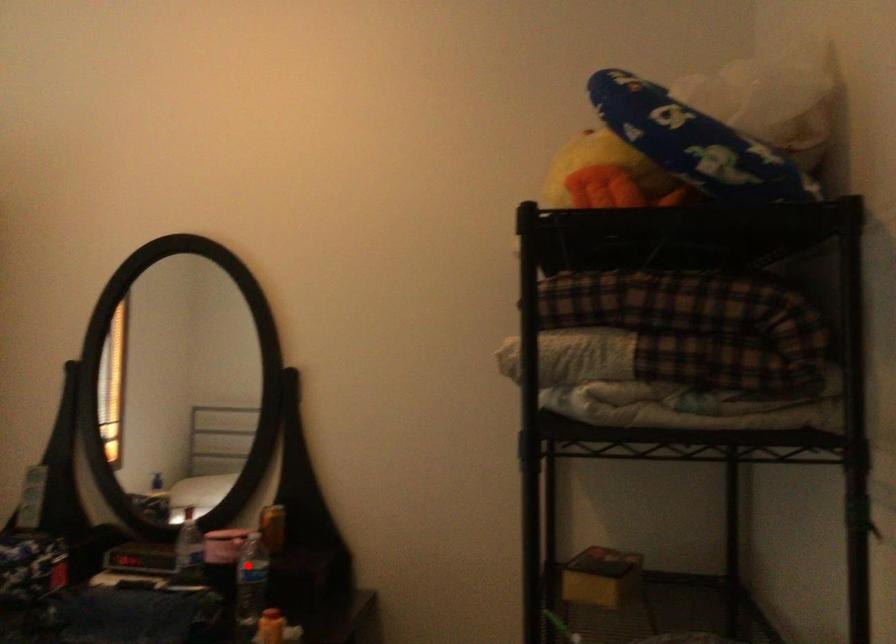
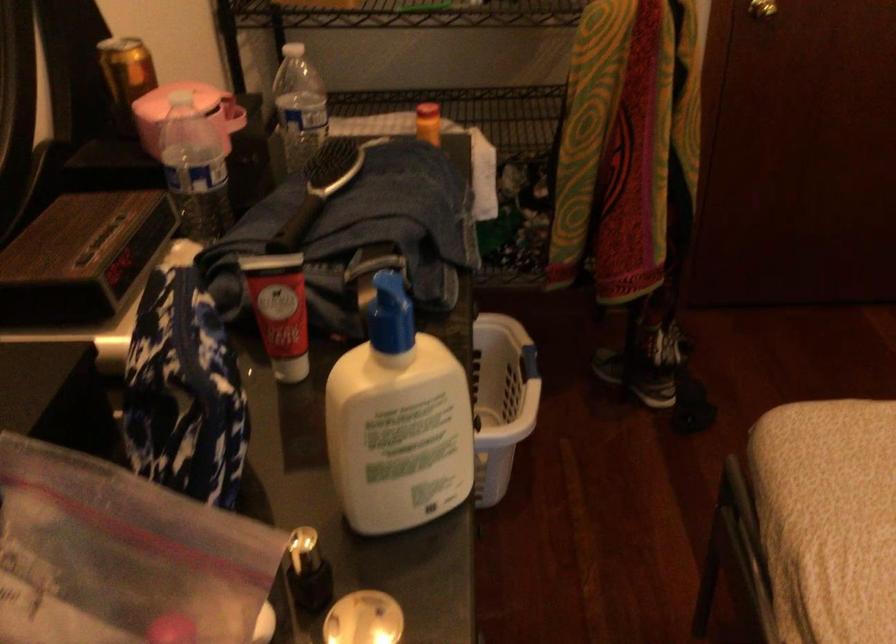
Where in the second image is the point corresponding to the highlighted location from the first image?

(298, 106)